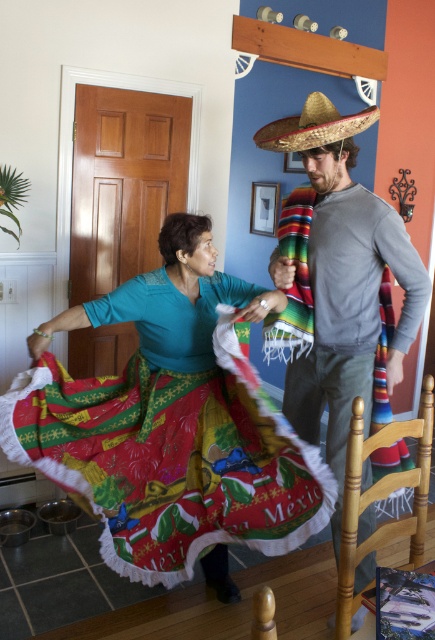
Does printed cotton skirt at center have a smaller size compared to natural straw sombrero at upper center?

No, printed cotton skirt at center is not smaller than natural straw sombrero at upper center.

Measure the distance between point (163, 356) and camera.

2.23 meters

Consider the image. Measure the distance between printed cotton skirt at center and camera.

printed cotton skirt at center is 2.04 meters away from camera.

Where is `printed cotton skirt at center`? The width and height of the screenshot is (435, 640). printed cotton skirt at center is located at coordinates (170, 301).

Which is in front, point (344, 452) or point (291, 132)?

Point (291, 132) is in front.

Does gray cotton shirt at center appear under natural straw sombrero at upper center?

Yes, gray cotton shirt at center is below natural straw sombrero at upper center.

Who is more forward, (358, 291) or (333, 104)?

Point (358, 291)

Identify the location of gray cotton shirt at center. This screenshot has height=640, width=435. (337, 284).

In the scene shown: Between gray cotton shirt at center and printed cotton skirt at center, which one appears on the left side from the viewer's perspective?

printed cotton skirt at center is more to the left.

Measure the distance between gray cotton shirt at center and printed cotton skirt at center.

They are 17.85 inches apart.

This screenshot has height=640, width=435. I want to click on gray cotton shirt at center, so coord(337,284).

Find the location of `gray cotton shirt at center`. gray cotton shirt at center is located at coordinates (337, 284).